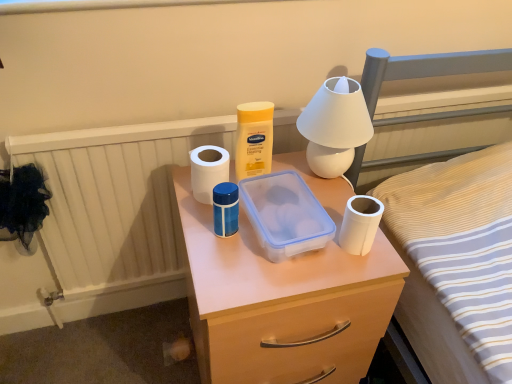
Where is `vacant space in front of white matte toilet paper at center, placed as the second toilet paper when sorted from front to back`? vacant space in front of white matte toilet paper at center, placed as the second toilet paper when sorted from front to back is located at coordinates (219, 249).